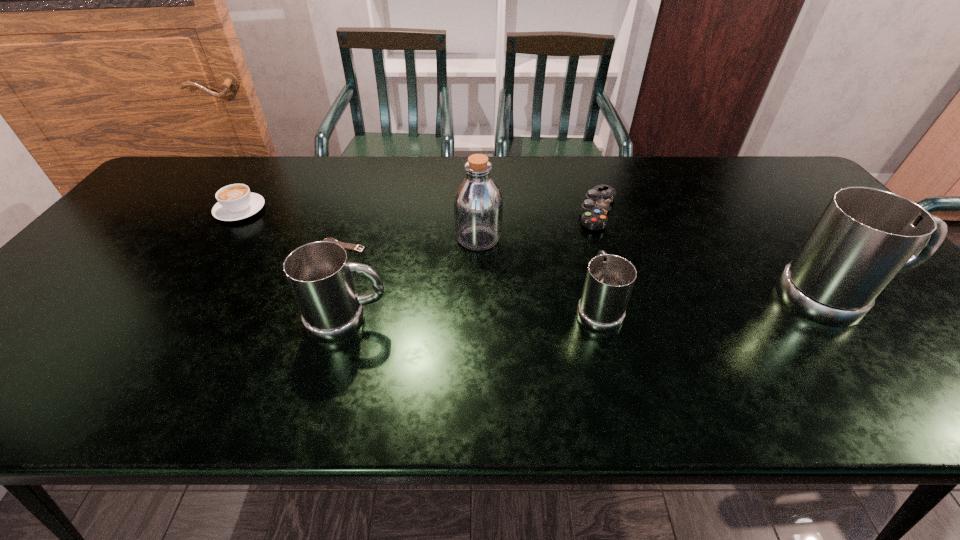
In the current image, all mugs are evenly spaced. To maintain this equal spacing, where should an additional mug be placed on the left? Please point out a free spot. Please provide its 2D coordinates. Your answer should be formatted as a tuple, i.e. [(x, y)], where the tuple contains the x and y coordinates of a point satisfying the conditions above.

[(86, 332)]